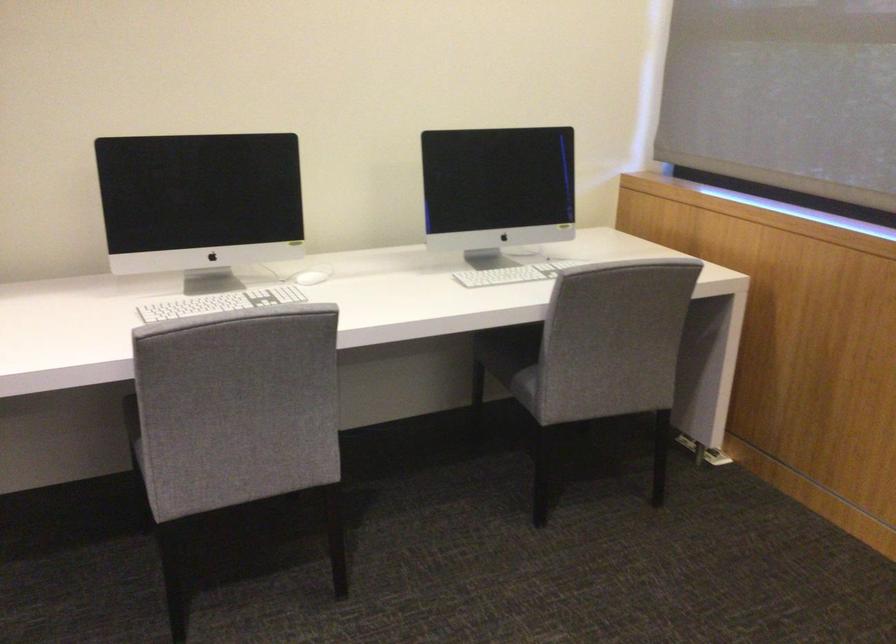
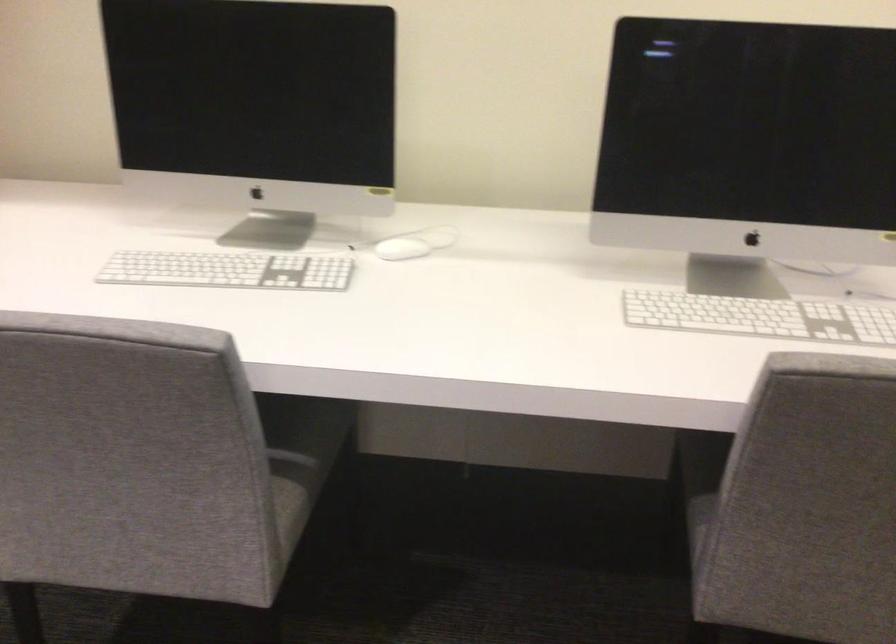
Find the pixel in the second image that matches pixel 288 409 in the first image.

(291, 456)